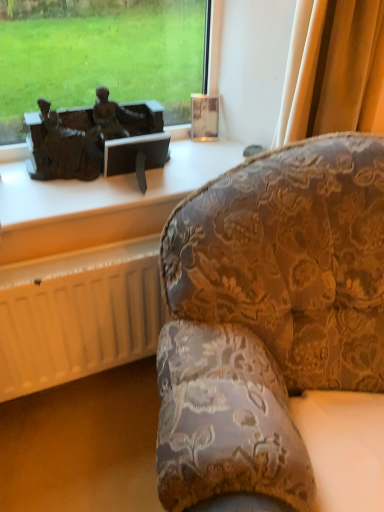
Question: Is matte bronze sculpture at upper left taller than white matte radiator at lower left?

Choices:
 (A) no
 (B) yes

Answer: (A)

Question: From the image's perspective, does matte bronze sculpture at upper left appear higher than white matte radiator at lower left?

Choices:
 (A) no
 (B) yes

Answer: (B)

Question: Is matte bronze sculpture at upper left turned away from white matte radiator at lower left?

Choices:
 (A) no
 (B) yes

Answer: (A)

Question: Does matte bronze sculpture at upper left turn towards white matte radiator at lower left?

Choices:
 (A) no
 (B) yes

Answer: (A)

Question: Is white matte radiator at lower left surrounded by matte bronze sculpture at upper left?

Choices:
 (A) no
 (B) yes

Answer: (A)

Question: Is the depth of matte bronze sculpture at upper left less than that of white matte radiator at lower left?

Choices:
 (A) no
 (B) yes

Answer: (A)

Question: Is velvet floral-patterned couch at right behind white matte radiator at lower left?

Choices:
 (A) no
 (B) yes

Answer: (A)

Question: Is velvet floral-patterned couch at right to the right of white matte radiator at lower left from the viewer's perspective?

Choices:
 (A) yes
 (B) no

Answer: (A)

Question: Can white matte radiator at lower left be found inside velvet floral-patterned couch at right?

Choices:
 (A) no
 (B) yes

Answer: (A)

Question: From a real-world perspective, is velvet floral-patterned couch at right under white matte radiator at lower left?

Choices:
 (A) no
 (B) yes

Answer: (A)

Question: Is velvet floral-patterned couch at right oriented away from white matte radiator at lower left?

Choices:
 (A) yes
 (B) no

Answer: (B)

Question: From the image's perspective, would you say velvet floral-patterned couch at right is shown under white matte radiator at lower left?

Choices:
 (A) no
 (B) yes

Answer: (B)

Question: Are bronze statue at left and white matte radiator at lower left located far from each other?

Choices:
 (A) yes
 (B) no

Answer: (B)